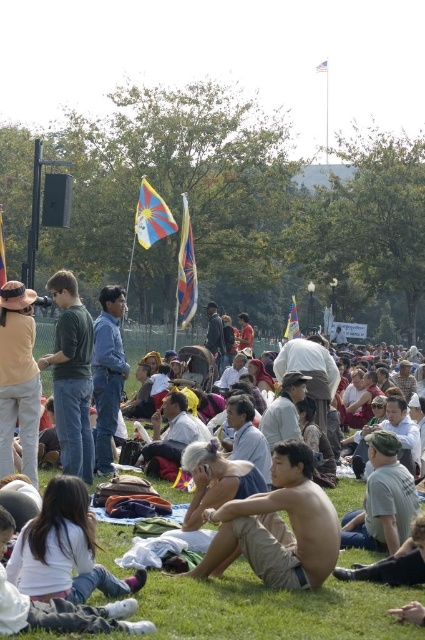
Is tan cotton shirt at center to the right of tan shorts at center from the viewer's perspective?

In fact, tan cotton shirt at center is to the left of tan shorts at center.

Consider the image. Does tan cotton shirt at center appear under tan shorts at center?

No, tan cotton shirt at center is not below tan shorts at center.

You are a GUI agent. You are given a task and a screenshot of the screen. Output one action in this format:
    pyautogui.click(x=<x>, y=<y>)
    Task: Click on the tan cotton shirt at center
    
    Given the screenshot: What is the action you would take?
    pyautogui.click(x=271, y=609)

I want to click on tan cotton shirt at center, so click(271, 609).

How much distance is there between tan cotton shirt at center and green cotton shirt at center?

They are 7.47 meters apart.

Who is lower down, tan cotton shirt at center or green cotton shirt at center?

Positioned lower is tan cotton shirt at center.

Identify the location of tan cotton shirt at center. The width and height of the screenshot is (425, 640). coord(271,609).

Image resolution: width=425 pixels, height=640 pixels. I want to click on tan cotton shirt at center, so click(x=271, y=609).

Is tan shorts at center above green cotton shirt at center?

No.

Between point (227, 512) and point (56, 400), which one is positioned behind?

The point (56, 400) is more distant.

The width and height of the screenshot is (425, 640). I want to click on tan shorts at center, so click(277, 528).